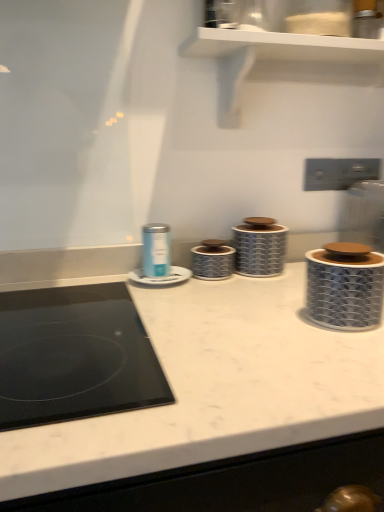
How much space does matte blue canister at center, which is counted as the 1th appliance, starting from the left, occupy vertically?

10.90 centimeters.

This screenshot has width=384, height=512. What do you see at coordinates (212, 261) in the screenshot?
I see `silver textured canister at center, which is counted as the third appliance, starting from the right` at bounding box center [212, 261].

Where is `matte blue canister at center, arranged as the fifth appliance when viewed from the right`? The image size is (384, 512). matte blue canister at center, arranged as the fifth appliance when viewed from the right is located at coordinates (156, 250).

From the image's perspective, between silver textured canister at center, the 3th appliance viewed from the left, and blue textured container at right, the fifth appliance from the left, who is located below?

blue textured container at right, the fifth appliance from the left.

Who is smaller, silver textured canister at center, the 3th appliance viewed from the left, or blue textured container at right, acting as the 1th appliance starting from the right?

silver textured canister at center, the 3th appliance viewed from the left.

From a real-world perspective, count 2nd appliances downward from the blue textured container at right, acting as the 1th appliance starting from the right, and point to it. Please provide its 2D coordinates.

[(212, 261)]

Is point (381, 294) farther from camera compared to point (193, 272)?

No, (381, 294) is closer to viewer.

Is blue textured container at right, the fifth appliance from the left, looking in the opposite direction of silver textured canister at center, the 3th appliance viewed from the left?

Correct, blue textured container at right, the fifth appliance from the left, is looking away from silver textured canister at center, the 3th appliance viewed from the left.

Is blue textured container at right, the fifth appliance from the left, not near silver textured canister at center, the 3th appliance viewed from the left?

No.

Considering the relative sizes of blue textured container at right, the fifth appliance from the left, and silver textured canister at center, which is counted as the third appliance, starting from the right, in the image provided, is blue textured container at right, the fifth appliance from the left, thinner than silver textured canister at center, which is counted as the third appliance, starting from the right,?

No, blue textured container at right, the fifth appliance from the left, is not thinner than silver textured canister at center, which is counted as the third appliance, starting from the right.

Is blue and white ceramic canister at center, the second appliance when ordered from right to left, shorter than silver textured canister at center, which is counted as the third appliance, starting from the right?

Incorrect, the height of blue and white ceramic canister at center, the second appliance when ordered from right to left, does not fall short of that of silver textured canister at center, which is counted as the third appliance, starting from the right.

From the picture: Does blue and white ceramic canister at center, which appears as the fourth appliance when viewed from the left, contain silver textured canister at center, the 3th appliance viewed from the left?

No, silver textured canister at center, the 3th appliance viewed from the left, is not surrounded by blue and white ceramic canister at center, which appears as the fourth appliance when viewed from the left.

Considering the relative positions of blue and white ceramic canister at center, which appears as the fourth appliance when viewed from the left, and silver textured canister at center, which is counted as the third appliance, starting from the right, in the image provided, is blue and white ceramic canister at center, which appears as the fourth appliance when viewed from the left, to the left of silver textured canister at center, which is counted as the third appliance, starting from the right, from the viewer's perspective?

In fact, blue and white ceramic canister at center, which appears as the fourth appliance when viewed from the left, is to the right of silver textured canister at center, which is counted as the third appliance, starting from the right.

Could you tell me if blue and white ceramic canister at center, the second appliance when ordered from right to left, is turned towards silver textured canister at center, which is counted as the third appliance, starting from the right?

No, blue and white ceramic canister at center, the second appliance when ordered from right to left, does not turn towards silver textured canister at center, which is counted as the third appliance, starting from the right.

Is matte blue canister at center, arranged as the fifth appliance when viewed from the right, to the right of silver textured canister at center, the 3th appliance viewed from the left, from the viewer's perspective?

Incorrect, matte blue canister at center, arranged as the fifth appliance when viewed from the right, is not on the right side of silver textured canister at center, the 3th appliance viewed from the left.

Is point (169, 260) closer to viewer compared to point (222, 261)?

No, it is not.

Is matte blue canister at center, arranged as the fifth appliance when viewed from the right, spatially inside silver textured canister at center, which is counted as the third appliance, starting from the right, or outside of it?

matte blue canister at center, arranged as the fifth appliance when viewed from the right, lies outside silver textured canister at center, which is counted as the third appliance, starting from the right.

Measure the distance from matte blue canister at center, which is counted as the 1th appliance, starting from the left, to silver textured canister at center, which is counted as the third appliance, starting from the right.

matte blue canister at center, which is counted as the 1th appliance, starting from the left, and silver textured canister at center, which is counted as the third appliance, starting from the right, are 4.00 inches apart.

Based on the photo, are blue and white ceramic canister at center, the second appliance when ordered from right to left, and blue textured container at right, acting as the 1th appliance starting from the right, located far from each other?

No, blue and white ceramic canister at center, the second appliance when ordered from right to left, is not far away from blue textured container at right, acting as the 1th appliance starting from the right.

Do you think blue and white ceramic canister at center, the second appliance when ordered from right to left, is within blue textured container at right, the fifth appliance from the left, or outside of it?

blue and white ceramic canister at center, the second appliance when ordered from right to left, lies outside blue textured container at right, the fifth appliance from the left.

Does blue and white ceramic canister at center, which appears as the fourth appliance when viewed from the left, turn towards blue textured container at right, the fifth appliance from the left?

Yes, blue and white ceramic canister at center, which appears as the fourth appliance when viewed from the left, faces towards blue textured container at right, the fifth appliance from the left.

Find the location of a particular element. The width and height of the screenshot is (384, 512). appliance on the right side of blue and white ceramic canister at center, which appears as the fourth appliance when viewed from the left is located at coordinates (345, 286).

Where is `the 1st appliance behind the matte blue canister at center, acting as the 4th appliance starting from the right`? the 1st appliance behind the matte blue canister at center, acting as the 4th appliance starting from the right is located at coordinates click(x=156, y=250).

From the image's perspective, would you say matte blue canister at center, which is the second appliance in left-to-right order, is shown under matte blue canister at center, arranged as the fifth appliance when viewed from the right?

Yes, from the image's perspective, matte blue canister at center, which is the second appliance in left-to-right order, is below matte blue canister at center, arranged as the fifth appliance when viewed from the right.

Is matte blue canister at center, acting as the 4th appliance starting from the right, to the right of matte blue canister at center, arranged as the fifth appliance when viewed from the right, from the viewer's perspective?

Yes.

Is matte blue canister at center, acting as the 4th appliance starting from the right, far from matte blue canister at center, arranged as the fifth appliance when viewed from the right?

No, matte blue canister at center, acting as the 4th appliance starting from the right, is not far from matte blue canister at center, arranged as the fifth appliance when viewed from the right.

From the image's perspective, which is below, matte blue canister at center, which is the second appliance in left-to-right order, or blue textured container at right, acting as the 1th appliance starting from the right?

matte blue canister at center, which is the second appliance in left-to-right order, from the image's perspective.

Considering the positions of points (137, 278) and (338, 320), is point (137, 278) farther from camera compared to point (338, 320)?

Yes, it is behind point (338, 320).

How distant is matte blue canister at center, acting as the 4th appliance starting from the right, from blue textured container at right, acting as the 1th appliance starting from the right?

A distance of 14.98 inches exists between matte blue canister at center, acting as the 4th appliance starting from the right, and blue textured container at right, acting as the 1th appliance starting from the right.

Based on the photo, which object is positioned more to the left, matte blue canister at center, which is the second appliance in left-to-right order, or blue textured container at right, the fifth appliance from the left?

matte blue canister at center, which is the second appliance in left-to-right order, is more to the left.

Which appliance is the 3rd one when counting from the front of the silver textured canister at center, which is counted as the third appliance, starting from the right? Please provide its 2D coordinates.

[(345, 286)]

This screenshot has width=384, height=512. What are the coordinates of `the 2nd appliance to the right when counting from the silver textured canister at center, the 3th appliance viewed from the left` in the screenshot? It's located at (345, 286).

Considering their positions, is blue textured container at right, the fifth appliance from the left, positioned closer to silver textured canister at center, the 3th appliance viewed from the left, than matte blue canister at center, acting as the 4th appliance starting from the right?

Based on the image, matte blue canister at center, acting as the 4th appliance starting from the right, appears to be nearer to silver textured canister at center, the 3th appliance viewed from the left.

From the image, which object appears to be farther from blue textured container at right, the fifth appliance from the left, matte blue canister at center, acting as the 4th appliance starting from the right, or blue and white ceramic canister at center, which appears as the fourth appliance when viewed from the left?

Among the two, matte blue canister at center, acting as the 4th appliance starting from the right, is located further to blue textured container at right, the fifth appliance from the left.

Looking at the image, which one is located further to matte blue canister at center, arranged as the fifth appliance when viewed from the right, blue and white ceramic canister at center, which appears as the fourth appliance when viewed from the left, or blue textured container at right, acting as the 1th appliance starting from the right?

Based on the image, blue textured container at right, acting as the 1th appliance starting from the right, appears to be further to matte blue canister at center, arranged as the fifth appliance when viewed from the right.

In the scene shown: Based on their spatial positions, is matte blue canister at center, acting as the 4th appliance starting from the right, or matte blue canister at center, which is counted as the 1th appliance, starting from the left, closer to silver textured canister at center, which is counted as the third appliance, starting from the right?

matte blue canister at center, acting as the 4th appliance starting from the right, lies closer to silver textured canister at center, which is counted as the third appliance, starting from the right, than the other object.

Based on their spatial positions, is blue textured container at right, acting as the 1th appliance starting from the right, or blue and white ceramic canister at center, which appears as the fourth appliance when viewed from the left, closer to matte blue canister at center, arranged as the fifth appliance when viewed from the right?

Among the two, blue and white ceramic canister at center, which appears as the fourth appliance when viewed from the left, is located nearer to matte blue canister at center, arranged as the fifth appliance when viewed from the right.

When comparing their distances from matte blue canister at center, acting as the 4th appliance starting from the right, does blue textured container at right, the fifth appliance from the left, or silver textured canister at center, the 3th appliance viewed from the left, seem further?

The object further to matte blue canister at center, acting as the 4th appliance starting from the right, is blue textured container at right, the fifth appliance from the left.

Which object lies further to the anchor point blue textured container at right, the fifth appliance from the left, matte blue canister at center, arranged as the fifth appliance when viewed from the right, or blue and white ceramic canister at center, the second appliance when ordered from right to left?

matte blue canister at center, arranged as the fifth appliance when viewed from the right, is further to blue textured container at right, the fifth appliance from the left.

From the image, which object appears to be nearer to silver textured canister at center, the 3th appliance viewed from the left, matte blue canister at center, acting as the 4th appliance starting from the right, or blue and white ceramic canister at center, which appears as the fourth appliance when viewed from the left?

Among the two, matte blue canister at center, acting as the 4th appliance starting from the right, is located nearer to silver textured canister at center, the 3th appliance viewed from the left.

Where is `appliance situated between matte blue canister at center, acting as the 4th appliance starting from the right, and blue and white ceramic canister at center, which appears as the fourth appliance when viewed from the left, from left to right`? appliance situated between matte blue canister at center, acting as the 4th appliance starting from the right, and blue and white ceramic canister at center, which appears as the fourth appliance when viewed from the left, from left to right is located at coordinates (212, 261).

The image size is (384, 512). Identify the location of appliance between matte blue canister at center, which is counted as the 1th appliance, starting from the left, and silver textured canister at center, the 3th appliance viewed from the left, from left to right. (161, 277).